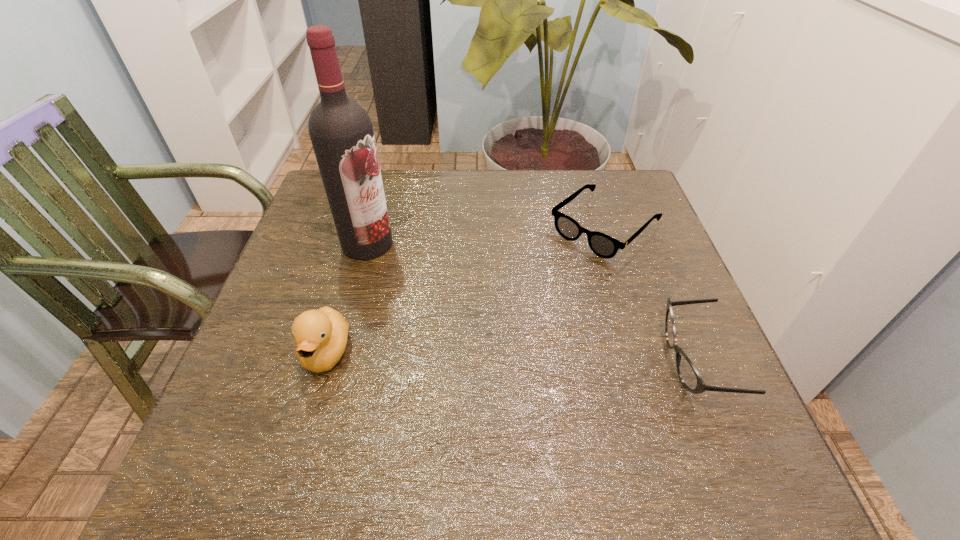
This screenshot has width=960, height=540. Find the location of `duckling`. duckling is located at coordinates (321, 335).

Image resolution: width=960 pixels, height=540 pixels. I want to click on the nearer spectacles, so click(x=689, y=376).

Where is `the tallest object`? the tallest object is located at coordinates (341, 132).

Where is `the farther spectacles`? the farther spectacles is located at coordinates (603, 245).

I want to click on blank space located 0.070m facing forward on the second tallest object, so (307, 420).

Image resolution: width=960 pixels, height=540 pixels. Identify the location of free space located 0.130m on the front-facing side of the nearer spectacles. (598, 361).

Identify the location of vacant space located on the front-facing side of the nearer spectacles. Image resolution: width=960 pixels, height=540 pixels. (583, 361).

The height and width of the screenshot is (540, 960). In order to click on vacant region located on the front-facing side of the nearer spectacles in this screenshot , I will do `click(588, 361)`.

Where is `vacant space located on the label of the tallest object`? Image resolution: width=960 pixels, height=540 pixels. vacant space located on the label of the tallest object is located at coordinates (399, 274).

Identify the location of vacant region located on the label of the tallest object. (480, 351).